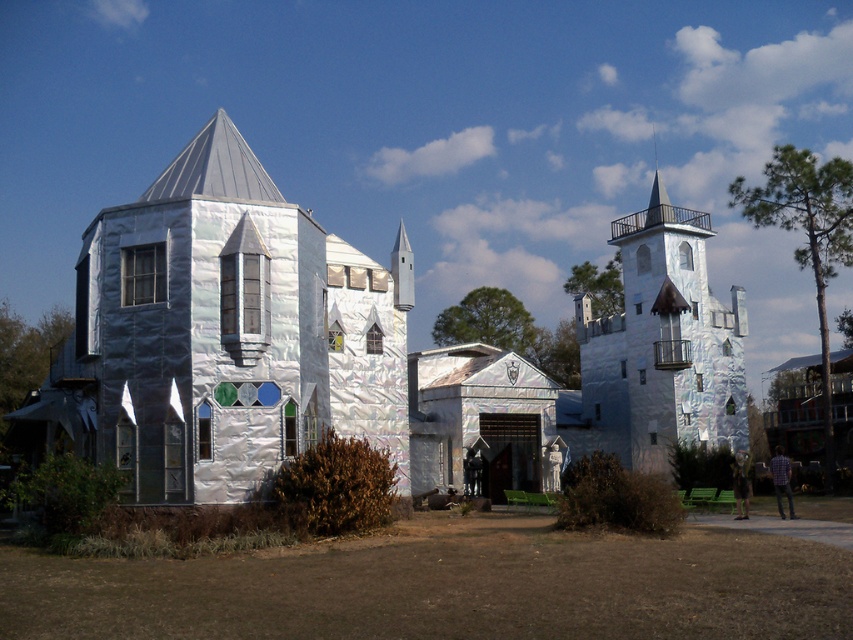
You are standing in front of the silver foil castle at center and want to walk towards the shiny silver castle at upper right. Which direction should you move to reach it?

To reach the shiny silver castle at upper right from the silver foil castle at center, you should move to the right since the shiny silver castle at upper right is located to the right of the silver foil castle at center.

You are a tour guide leading a group of visitors to the silver foil castle at center. There is also a shiny silver castle at upper right nearby. Your group wants to know which one is closer to the entrance of the park. Can you determine this based on the image?

The silver foil castle at center and shiny silver castle at upper right are 6.32 meters apart from each other. However, the image does not provide information about their distance to the park entrance, so I cannot determine which is closer to the entrance.

You are a guest at a party and want to take a photo with both the silver foil castle at center and the shiny silver castle at upper right. Since you can only focus on one castle at a time, which one should you stand closer to in order to include both in the frame?

You should stand closer to the shiny silver castle at upper right because it is smaller than the silver foil castle at center. By moving closer to the smaller castle, you can fit both castles into the camera frame more easily.